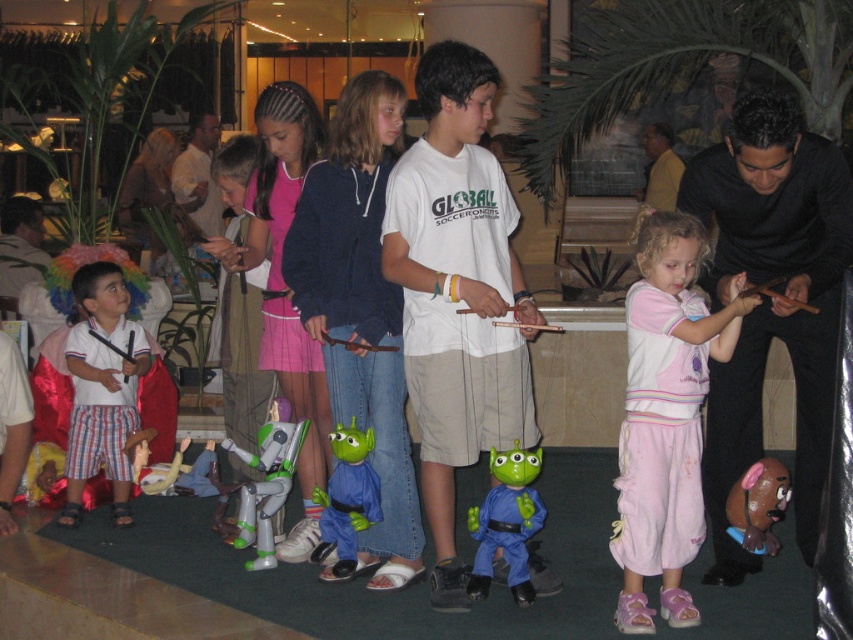
Who is shorter, pink cotton pants at center or green rubber alien at center?

With less height is green rubber alien at center.

This screenshot has height=640, width=853. What do you see at coordinates (665, 417) in the screenshot?
I see `pink cotton pants at center` at bounding box center [665, 417].

You are a GUI agent. You are given a task and a screenshot of the screen. Output one action in this format:
    pyautogui.click(x=<x>, y=<y>)
    Task: Click on the pink cotton pants at center
    
    Given the screenshot: What is the action you would take?
    pyautogui.click(x=665, y=417)

Is matte pink skirt at center behind brown rubber toy at lower right?

That is True.

From the picture: How much distance is there between matte pink skirt at center and brown rubber toy at lower right?

A distance of 2.59 meters exists between matte pink skirt at center and brown rubber toy at lower right.

Where is `matte pink skirt at center`? Image resolution: width=853 pixels, height=640 pixels. matte pink skirt at center is located at coordinates (239, 300).

Where is `pink cotton pants at center`? The image size is (853, 640). pink cotton pants at center is located at coordinates (665, 417).

Is pink cotton pants at center bigger than brown rubber toy at lower right?

Correct, pink cotton pants at center is larger in size than brown rubber toy at lower right.

Is point (676, 540) positioned behind point (733, 490)?

Yes.

Find the location of a particular element. pink cotton pants at center is located at coordinates coord(665,417).